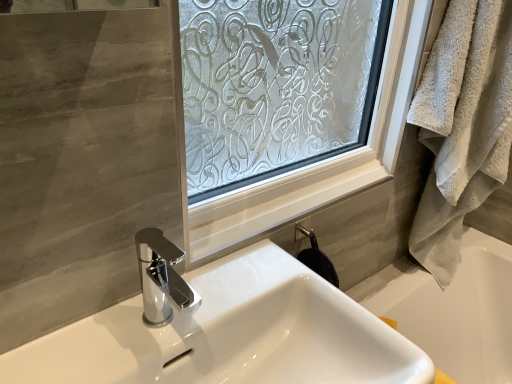
The width and height of the screenshot is (512, 384). Describe the element at coordinates (462, 126) in the screenshot. I see `beige fluffy towel at right` at that location.

Measure the distance between point (x=477, y=189) and camera.

They are 1.09 meters apart.

Where is `white glossy bathtub at lower right`? white glossy bathtub at lower right is located at coordinates (452, 309).

Is white glossy sink at center looking in the opposite direction of beige fluffy towel at right?

white glossy sink at center does not have its back to beige fluffy towel at right.

Is point (133, 365) behind point (443, 173)?

No, (133, 365) is closer to viewer.

Who is bigger, white glossy sink at center or beige fluffy towel at right?

With larger size is white glossy sink at center.

From a real-world perspective, is white glossy sink at center on top of beige fluffy towel at right?

No, from a real-world perspective, white glossy sink at center is not on top of beige fluffy towel at right.

Considering the points (433, 96) and (465, 229), which point is in front, point (433, 96) or point (465, 229)?

The point (433, 96) is closer to the camera.

From the image's perspective, is beige fluffy towel at right under white glossy bathtub at lower right?

No, from the image's perspective, beige fluffy towel at right is not below white glossy bathtub at lower right.

Which of these two, beige fluffy towel at right or white glossy bathtub at lower right, is thinner?

With smaller width is white glossy bathtub at lower right.

Would you say beige fluffy towel at right contains white glossy bathtub at lower right?

No, white glossy bathtub at lower right is not a part of beige fluffy towel at right.

Is white glossy bathtub at lower right shorter than white glossy sink at center?

Yes, white glossy bathtub at lower right is shorter than white glossy sink at center.

Between point (409, 281) and point (345, 355), which one is positioned behind?

Positioned behind is point (409, 281).

Is white glossy bathtub at lower right beside white glossy sink at center?

No.

Where is `sink located above the white glossy bathtub at lower right (from a real-world perspective)`? The height and width of the screenshot is (384, 512). sink located above the white glossy bathtub at lower right (from a real-world perspective) is located at coordinates (230, 335).

Considering the relative sizes of white glossy sink at center and white glossy bathtub at lower right in the image provided, is white glossy sink at center shorter than white glossy bathtub at lower right?

In fact, white glossy sink at center may be taller than white glossy bathtub at lower right.

Identify the location of bath that is under the white glossy sink at center (from a real-world perspective). This screenshot has height=384, width=512. click(x=452, y=309).

From a real-world perspective, who is located higher, white glossy sink at center or white glossy bathtub at lower right?

From a 3D spatial view, white glossy sink at center is above.

Is white glossy sink at center facing away from white glossy bathtub at lower right?

No, white glossy bathtub at lower right is not at the back of white glossy sink at center.

Considering the sizes of objects beige fluffy towel at right and white glossy sink at center in the image provided, who is wider, beige fluffy towel at right or white glossy sink at center?

white glossy sink at center is wider.

From a real-world perspective, which object rests below the other?

white glossy sink at center, from a real-world perspective.

Can you confirm if beige fluffy towel at right is smaller than white glossy sink at center?

Correct, beige fluffy towel at right occupies less space than white glossy sink at center.

In the image, there is a beige fluffy towel at right. Where is `bath below it (from the image's perspective)`? bath below it (from the image's perspective) is located at coordinates (452, 309).

Choose the correct answer: Is white glossy bathtub at lower right inside beige fluffy towel at right or outside it?

The correct answer is: outside.

Which object is closer to the camera taking this photo, white glossy bathtub at lower right or beige fluffy towel at right?

Positioned in front is beige fluffy towel at right.

I want to click on sink on the left of beige fluffy towel at right, so click(230, 335).

Locate an element on the screen. The image size is (512, 384). bath towel on the right of white glossy bathtub at lower right is located at coordinates (462, 126).

From the image, which object appears to be farther from white glossy bathtub at lower right, white glossy sink at center or beige fluffy towel at right?

white glossy sink at center.

Based on their spatial positions, is beige fluffy towel at right or white glossy sink at center further from white glossy bathtub at lower right?

white glossy sink at center is further to white glossy bathtub at lower right.

Considering their positions, is white glossy sink at center positioned further to beige fluffy towel at right than white glossy bathtub at lower right?

Among the two, white glossy sink at center is located further to beige fluffy towel at right.

Looking at the image, which one is located closer to white glossy sink at center, beige fluffy towel at right or white glossy bathtub at lower right?

beige fluffy towel at right lies closer to white glossy sink at center than the other object.

Based on their spatial positions, is white glossy bathtub at lower right or white glossy sink at center closer to beige fluffy towel at right?

white glossy bathtub at lower right is positioned closer to the anchor beige fluffy towel at right.

Considering their positions, is white glossy bathtub at lower right positioned further to white glossy sink at center than beige fluffy towel at right?

white glossy bathtub at lower right lies further to white glossy sink at center than the other object.

At what (x,y) coordinates should I click in order to perform the action: click on bath towel positioned between white glossy sink at center and white glossy bathtub at lower right from near to far. Please return your answer as a coordinate pair (x, y). Looking at the image, I should click on (462, 126).